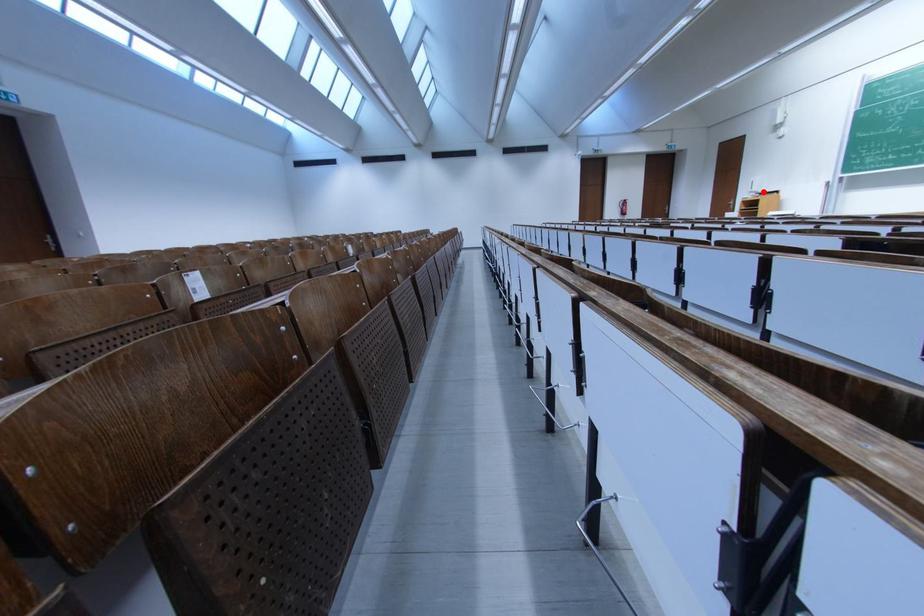
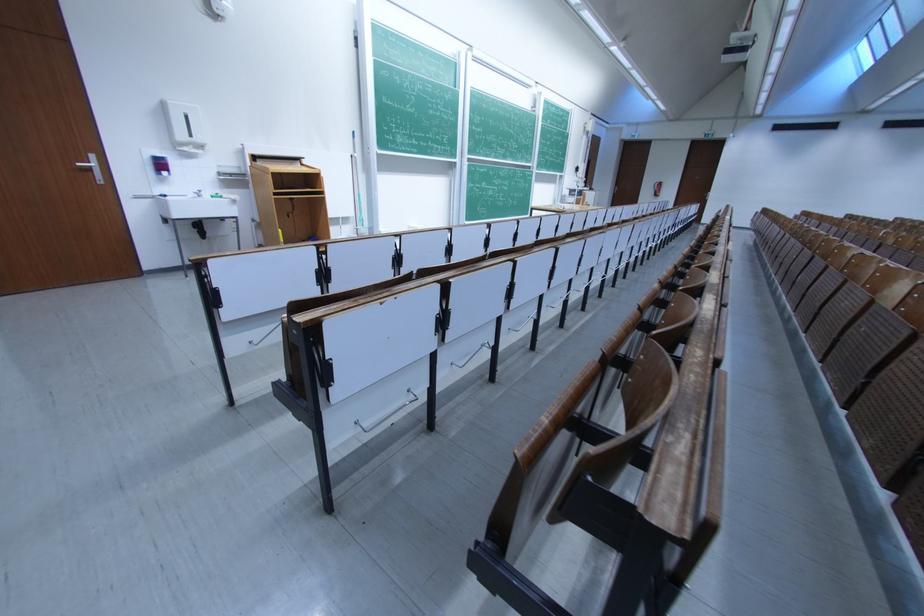
In the second image, find the point that corresponds to the highlighted location in the first image.

(205, 142)